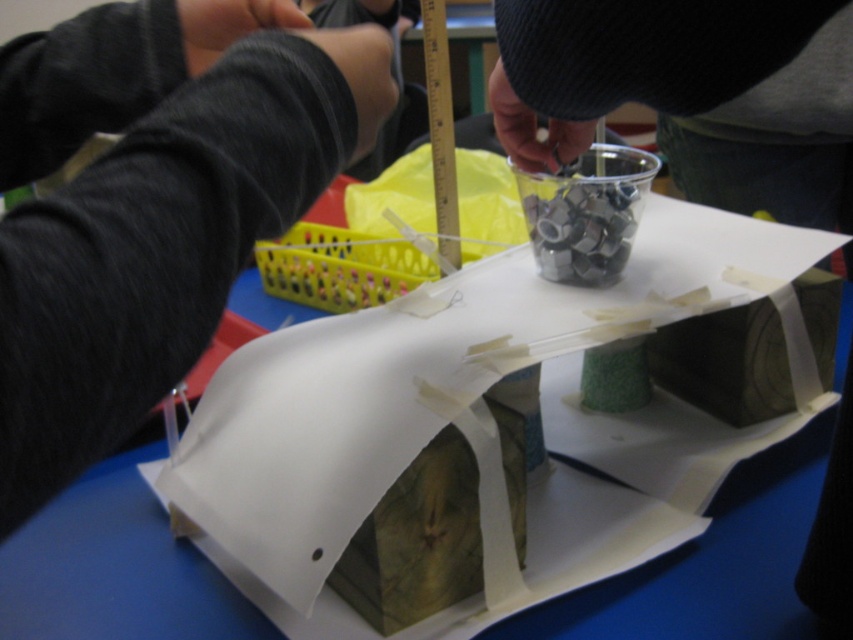
Question: Which point is farther to the camera?

Choices:
 (A) (32, 438)
 (B) (656, 76)

Answer: (B)

Question: Which object is farther from the camera taking this photo?

Choices:
 (A) black fabric arm at upper left
 (B) green textured cup at upper center

Answer: (B)

Question: Which of the following is the closest to the observer?

Choices:
 (A) (701, 90)
 (B) (248, 250)

Answer: (B)

Question: Can you confirm if black fabric arm at upper left is positioned below green textured cup at upper center?

Choices:
 (A) no
 (B) yes

Answer: (B)

Question: Is black fabric arm at upper left in front of green textured cup at upper center?

Choices:
 (A) yes
 (B) no

Answer: (A)

Question: Is black fabric arm at upper left in front of green textured cup at upper center?

Choices:
 (A) yes
 (B) no

Answer: (A)